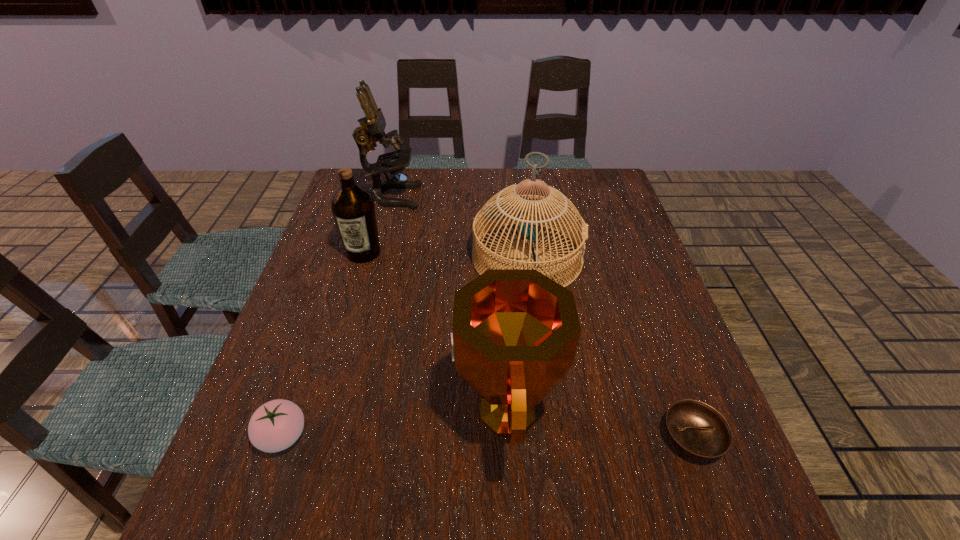
Locate an element on the screen. The height and width of the screenshot is (540, 960). object present at the right edge is located at coordinates (696, 429).

Identify the location of object that is at the far left corner. (372, 128).

Locate an element on the screen. This screenshot has height=540, width=960. blank area at the far edge is located at coordinates (458, 178).

At what (x,y) coordinates should I click in order to perform the action: click on vacant space at the near edge of the desktop. Please return your answer as a coordinate pair (x, y). The height and width of the screenshot is (540, 960). Looking at the image, I should click on (469, 503).

I want to click on vacant area at the left edge of the desktop, so click(298, 328).

Find the location of a particular element. Image resolution: width=960 pixels, height=540 pixels. vacant region at the right edge of the desktop is located at coordinates (669, 359).

The height and width of the screenshot is (540, 960). I want to click on free space at the near left corner of the desktop, so click(x=266, y=512).

At what (x,y) coordinates should I click in order to perform the action: click on free region at the far right corner of the desktop. Please return your answer as a coordinate pair (x, y). Looking at the image, I should click on (570, 171).

Locate an element on the screen. free space at the near right corner is located at coordinates (731, 513).

Identify the location of vacant space in between the award and the olive oil. (434, 332).